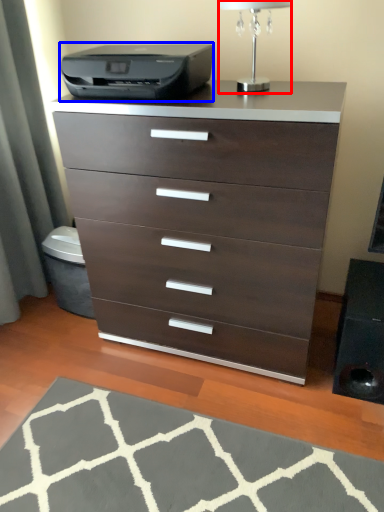
Question: Which object appears farthest to the camera in this image, table lamp (highlighted by a red box) or printer (highlighted by a blue box)?

Choices:
 (A) table lamp
 (B) printer

Answer: (B)